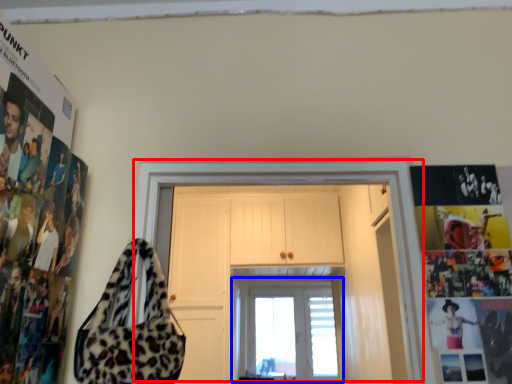
Question: Which point is closer to the camera, door (highlighted by a red box) or window (highlighted by a blue box)?

Choices:
 (A) door
 (B) window

Answer: (A)